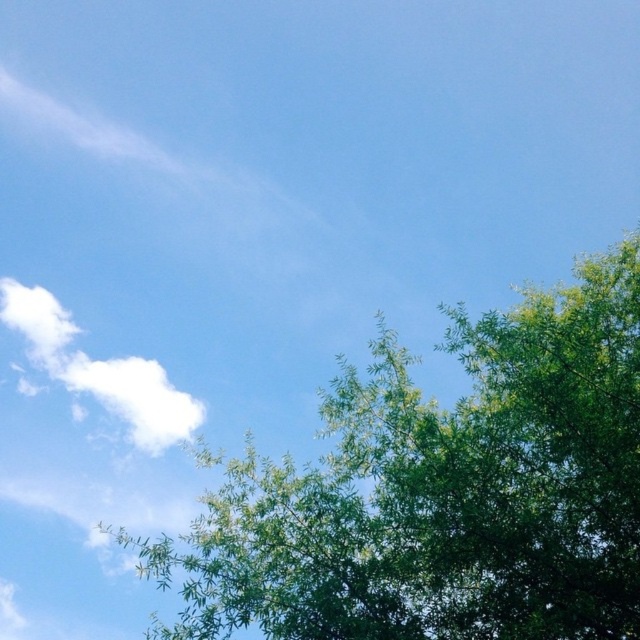
Question: Which point appears closest to the camera in this image?

Choices:
 (A) (189, 419)
 (B) (424, 602)

Answer: (B)

Question: Is green leafy tree at upper center below white fluffy cloud at upper left?

Choices:
 (A) yes
 (B) no

Answer: (A)

Question: Does green leafy tree at upper center have a smaller size compared to white fluffy cloud at upper left?

Choices:
 (A) no
 (B) yes

Answer: (A)

Question: Is green leafy tree at upper center to the right of white fluffy cloud at upper left from the viewer's perspective?

Choices:
 (A) no
 (B) yes

Answer: (B)

Question: Which object appears closest to the camera in this image?

Choices:
 (A) white fluffy cloud at upper left
 (B) green leafy tree at upper center

Answer: (B)